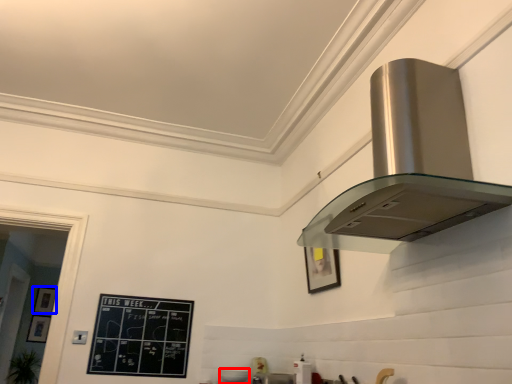
Question: Which object appears farthest to the camera in this image, appliance (highlighted by a red box) or picture frame (highlighted by a blue box)?

Choices:
 (A) appliance
 (B) picture frame

Answer: (B)